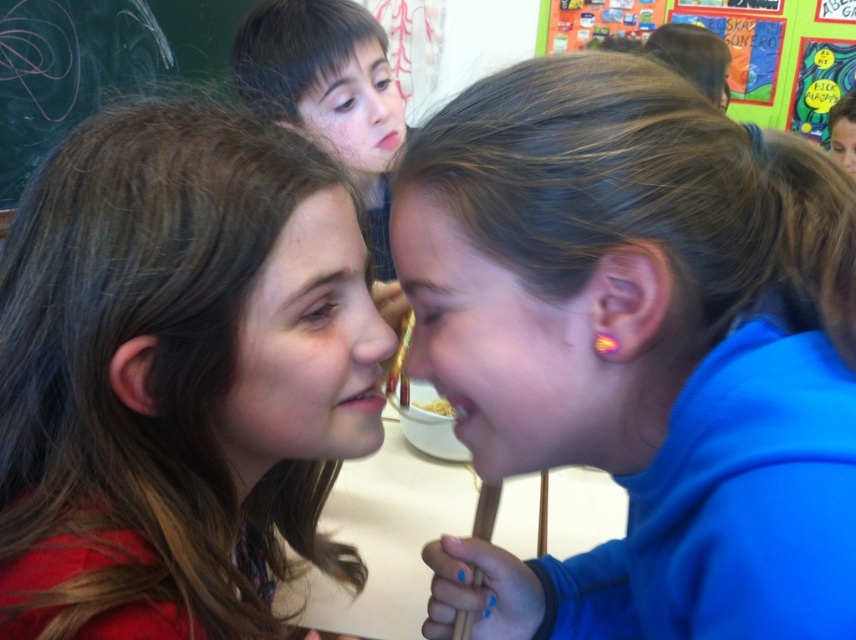
Between point (247, 348) and point (328, 145), which one is positioned in front?

Point (247, 348)

Does brown hair at left have a larger size compared to smooth skin face at upper center?

Incorrect, brown hair at left is not larger than smooth skin face at upper center.

Locate an element on the screen. This screenshot has width=856, height=640. brown hair at left is located at coordinates (177, 376).

Who is lower down, matte blue ear at center or brown hair at upper center?

matte blue ear at center

Who is positioned more to the right, matte blue ear at center or brown hair at upper center?

Positioned to the right is matte blue ear at center.

Identify the location of matte blue ear at center. (484, 342).

Which is more to the left, matte blue ear at center or matte blue hair at upper center?

matte blue ear at center

Can you confirm if matte blue ear at center is wider than matte blue hair at upper center?

Incorrect, matte blue ear at center's width does not surpass matte blue hair at upper center's.

Who is more distant from viewer, (492, 424) or (835, 134)?

Point (835, 134)

You are a GUI agent. You are given a task and a screenshot of the screen. Output one action in this format:
    pyautogui.click(x=<x>, y=<y>)
    Task: Click on the matte blue ear at center
    This screenshot has height=640, width=856.
    Given the screenshot: What is the action you would take?
    pyautogui.click(x=484, y=342)